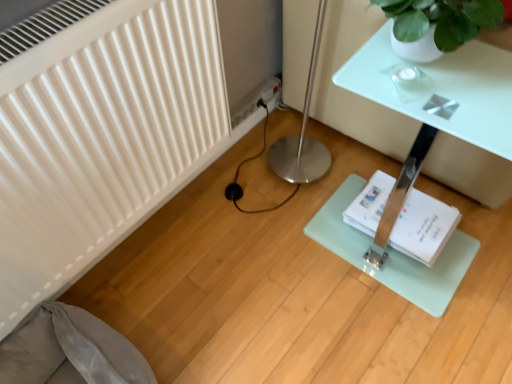
Question: Is white paper book at center shorter than gray fabric swivel chair at lower left?

Choices:
 (A) no
 (B) yes

Answer: (B)

Question: Considering the relative sizes of white paper book at center and gray fabric swivel chair at lower left in the image provided, is white paper book at center bigger than gray fabric swivel chair at lower left?

Choices:
 (A) yes
 (B) no

Answer: (B)

Question: Can you confirm if white paper book at center is thinner than gray fabric swivel chair at lower left?

Choices:
 (A) yes
 (B) no

Answer: (A)

Question: Is white paper book at center to the right of gray fabric swivel chair at lower left from the viewer's perspective?

Choices:
 (A) yes
 (B) no

Answer: (A)

Question: Is white paper book at center not close to gray fabric swivel chair at lower left?

Choices:
 (A) no
 (B) yes

Answer: (A)

Question: Is point (424, 243) closer or farther from the camera than point (56, 350)?

Choices:
 (A) closer
 (B) farther

Answer: (B)

Question: Is white paper book at center taller or shorter than gray fabric swivel chair at lower left?

Choices:
 (A) short
 (B) tall

Answer: (A)

Question: Is white paper book at center bigger or smaller than gray fabric swivel chair at lower left?

Choices:
 (A) big
 (B) small

Answer: (B)

Question: From the image's perspective, is white paper book at center positioned above or below gray fabric swivel chair at lower left?

Choices:
 (A) above
 (B) below

Answer: (A)

Question: Looking at their shapes, would you say clear glass table at center is wider or thinner than gray fabric swivel chair at lower left?

Choices:
 (A) wide
 (B) thin

Answer: (A)

Question: From the image's perspective, relative to gray fabric swivel chair at lower left, is clear glass table at center above or below?

Choices:
 (A) below
 (B) above

Answer: (B)

Question: Considering the relative positions of clear glass table at center and gray fabric swivel chair at lower left in the image provided, is clear glass table at center to the left or to the right of gray fabric swivel chair at lower left?

Choices:
 (A) left
 (B) right

Answer: (B)

Question: From a real-world perspective, is clear glass table at center physically located above or below gray fabric swivel chair at lower left?

Choices:
 (A) below
 (B) above

Answer: (B)

Question: Is clear glass table at center wider or thinner than white paper book at center?

Choices:
 (A) thin
 (B) wide

Answer: (B)

Question: Do you think clear glass table at center is within white paper book at center, or outside of it?

Choices:
 (A) outside
 (B) inside

Answer: (A)